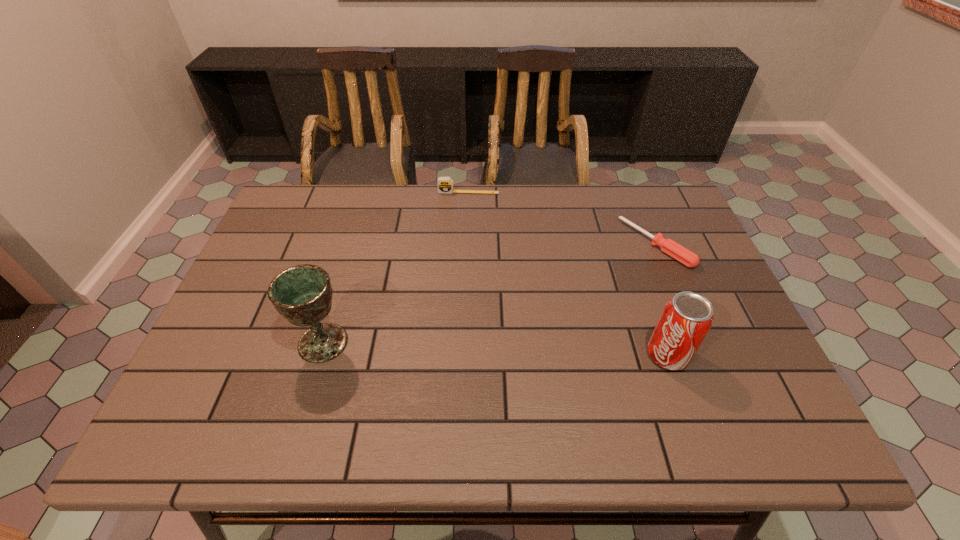
The width and height of the screenshot is (960, 540). Find the location of `free spot between the third tallest object and the chalice`. free spot between the third tallest object and the chalice is located at coordinates (396, 267).

Identify the location of free space between the second farthest object and the soda can. (661, 300).

Identify the location of free space between the tape measure and the third shortest object. Image resolution: width=960 pixels, height=540 pixels. (568, 274).

I want to click on free space between the second farthest object and the chalice, so click(490, 294).

You are a GUI agent. You are given a task and a screenshot of the screen. Output one action in this format:
    pyautogui.click(x=<x>, y=<y>)
    Task: Click on the free spot between the screwdriver and the chalice
    The width and height of the screenshot is (960, 540).
    Given the screenshot: What is the action you would take?
    pyautogui.click(x=490, y=294)

You are a GUI agent. You are given a task and a screenshot of the screen. Output one action in this format:
    pyautogui.click(x=<x>, y=<y>)
    Task: Click on the empty location between the second tallest object and the third tallest object
    This screenshot has height=540, width=960.
    Given the screenshot: What is the action you would take?
    pyautogui.click(x=568, y=274)

Where is `unoccupied position between the third tallest object and the soda can`? This screenshot has width=960, height=540. unoccupied position between the third tallest object and the soda can is located at coordinates (568, 274).

Locate an element on the screen. This screenshot has height=540, width=960. vacant space that's between the screwdriver and the leftmost object is located at coordinates pos(490,294).

Where is `free space between the screwdriver and the soda can`? free space between the screwdriver and the soda can is located at coordinates (661, 300).

Locate an element on the screen. The height and width of the screenshot is (540, 960). free space between the tape measure and the soda can is located at coordinates (568, 274).